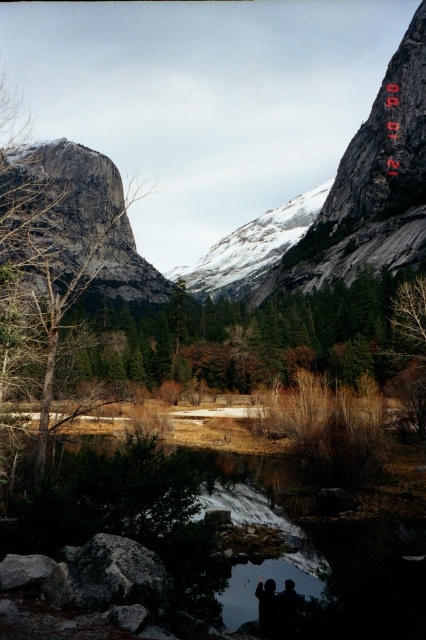
You are standing in the valley looking at the mountains and the water. There are two points marked in the scene, one at coordinates point (57, 152) and another at point (276, 582). Which point is closer to you?

Point (57, 152) is closer to you because it is further to the viewer than point (276, 582).

You are standing in the valley and notice a dark gray jacket at lower center and a transparent glass puddle at lower center. Which object is closer to you?

The transparent glass puddle at lower center is closer to you because the dark gray jacket at lower center is behind it.

You are standing in the serene landscape described and notice both the transparent glass puddle at lower center and the dark gray jacket at lower center. Which object occupies more space in the scene?

The transparent glass puddle at lower center is bigger than the dark gray jacket at lower center, so it occupies more space in the scene.